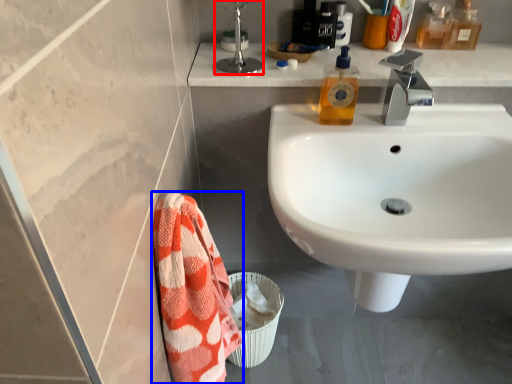
Question: Among these objects, which one is nearest to the camera, plumbing fixture (highlighted by a red box) or beach towel (highlighted by a blue box)?

Choices:
 (A) plumbing fixture
 (B) beach towel

Answer: (B)